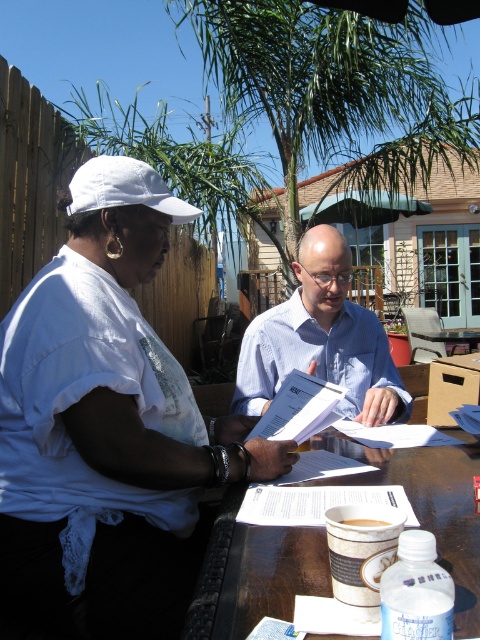
Question: Which of the following is the farthest from the observer?

Choices:
 (A) white cotton shirt at upper left
 (B) brown matte cup at center
 (C) white fabric baseball cap at upper left
 (D) wooden table at center

Answer: (C)

Question: Which object appears closest to the camera in this image?

Choices:
 (A) white fabric baseball cap at upper left
 (B) blue shirt at center
 (C) white cotton shirt at upper left

Answer: (C)

Question: Does blue shirt at center appear on the left side of white fabric baseball cap at upper left?

Choices:
 (A) yes
 (B) no

Answer: (B)

Question: Does white cotton shirt at upper left have a greater width compared to white fabric baseball cap at upper left?

Choices:
 (A) yes
 (B) no

Answer: (A)

Question: Which is farther from the blue shirt at center?

Choices:
 (A) brown matte cup at center
 (B) white fabric baseball cap at upper left
 (C) white cotton shirt at upper left
 (D) wooden table at center

Answer: (A)

Question: Is white fabric baseball cap at upper left to the right of brown matte cup at center from the viewer's perspective?

Choices:
 (A) yes
 (B) no

Answer: (B)